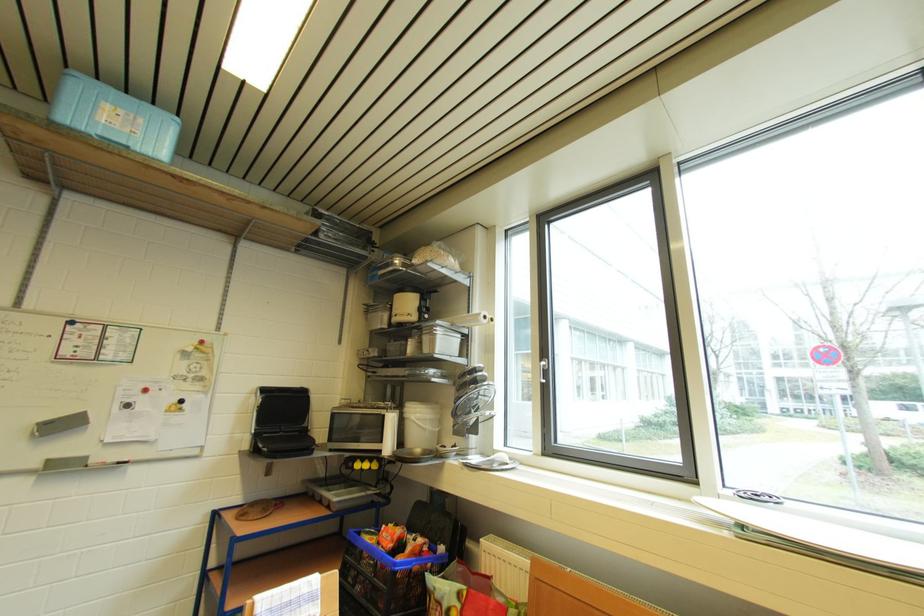
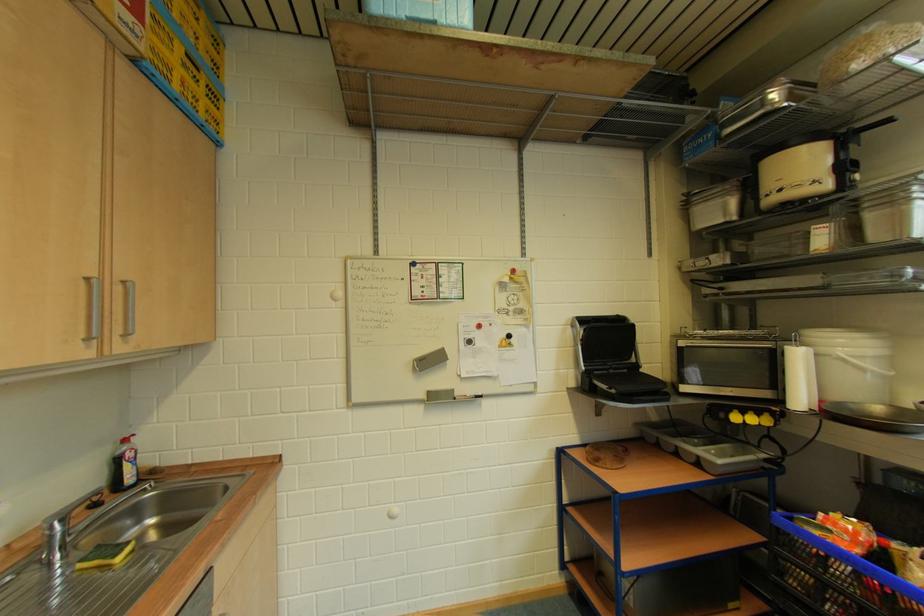
Locate, in the second image, the point that corresponds to (x=398, y=422) in the first image.

(805, 359)